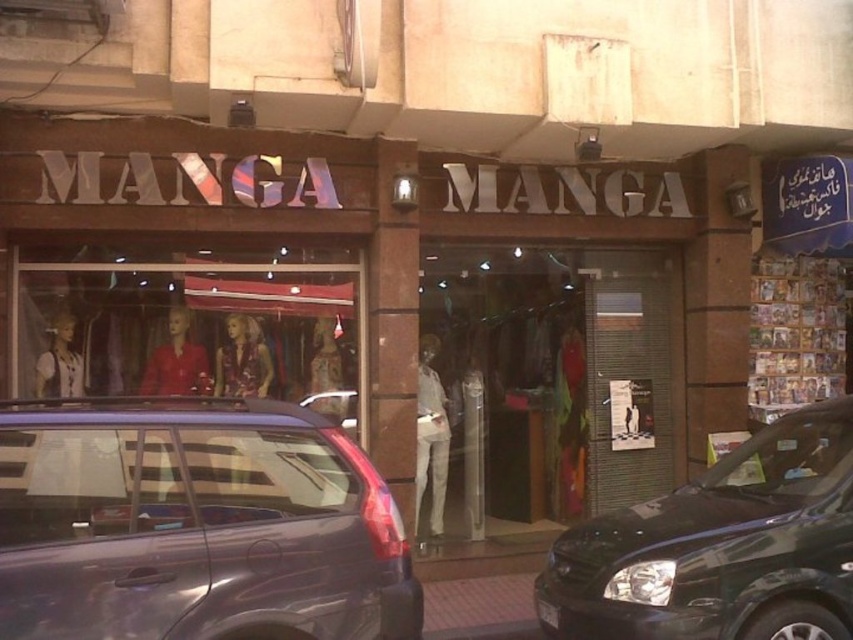
Question: Which object is the closest to the shiny black car at right?

Choices:
 (A) black plastic license plate at center
 (B) matte glass mannequins at center

Answer: (A)

Question: Among these objects, which one is farthest from the camera?

Choices:
 (A) black plastic license plate at center
 (B) matte glass mannequins at center

Answer: (B)

Question: Is matte glass mannequins at center positioned in front of black plastic license plate at center?

Choices:
 (A) yes
 (B) no

Answer: (B)

Question: Is shiny black car at right thinner than matte glass mannequins at center?

Choices:
 (A) yes
 (B) no

Answer: (A)

Question: Is the position of satin purple car at lower left less distant than that of shiny black car at right?

Choices:
 (A) yes
 (B) no

Answer: (A)

Question: Which point is farther from the camera taking this photo?

Choices:
 (A) (85, 349)
 (B) (712, 596)
 (C) (535, 600)

Answer: (A)